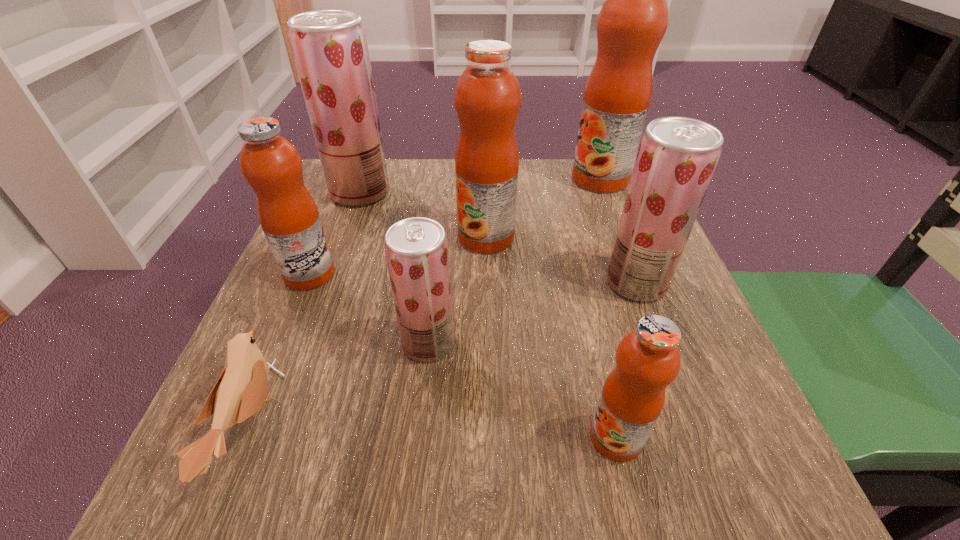
At what (x,y) coordinates should I click in order to perform the action: click on the second strawberry fruit juice from left to right. Please return your answer as a coordinate pair (x, y). The width and height of the screenshot is (960, 540). Looking at the image, I should click on (416, 249).

Find the location of a particular element. the smallest strawberry fruit juice is located at coordinates (416, 249).

Locate an element on the screen. This screenshot has width=960, height=540. the fifth fruit juice from left to right is located at coordinates (648, 359).

Where is `the nearest fruit juice`? the nearest fruit juice is located at coordinates (648, 359).

Locate an element on the screen. The width and height of the screenshot is (960, 540). bird is located at coordinates (239, 393).

Identify the location of vacant region located 0.180m on the front label of the rightmost orange fruit juice. (499, 179).

The height and width of the screenshot is (540, 960). What are the coordinates of `free space located on the front label of the rightmost orange fruit juice` in the screenshot? It's located at 516,179.

Identify the location of free space located on the front label of the rightmost orange fruit juice. The height and width of the screenshot is (540, 960). (532, 179).

The height and width of the screenshot is (540, 960). Find the location of `vacant position located 0.130m on the front of the farthest strawberry fruit juice`. vacant position located 0.130m on the front of the farthest strawberry fruit juice is located at coordinates (341, 245).

What are the coordinates of `vacant region located on the front label of the sixth nearest object` in the screenshot? It's located at (411, 237).